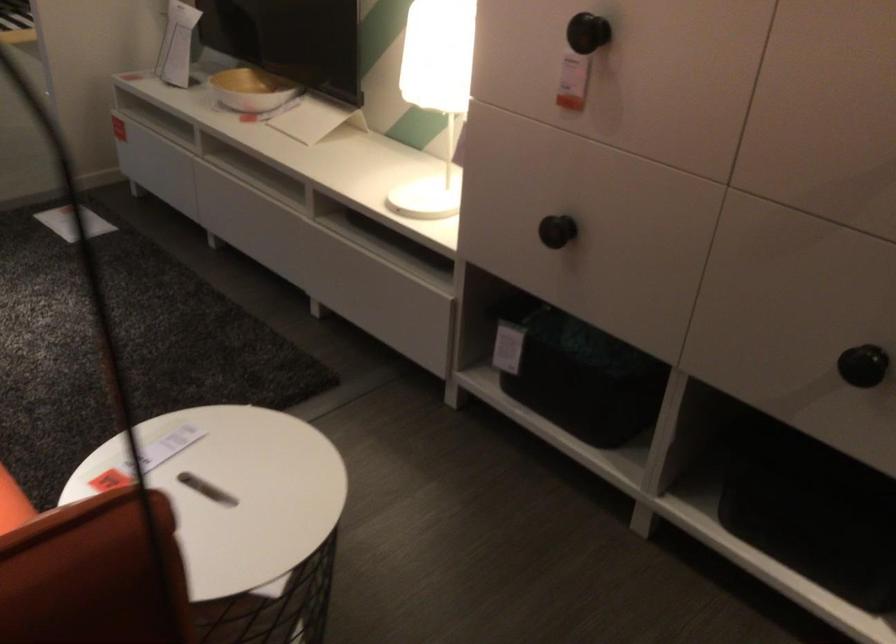
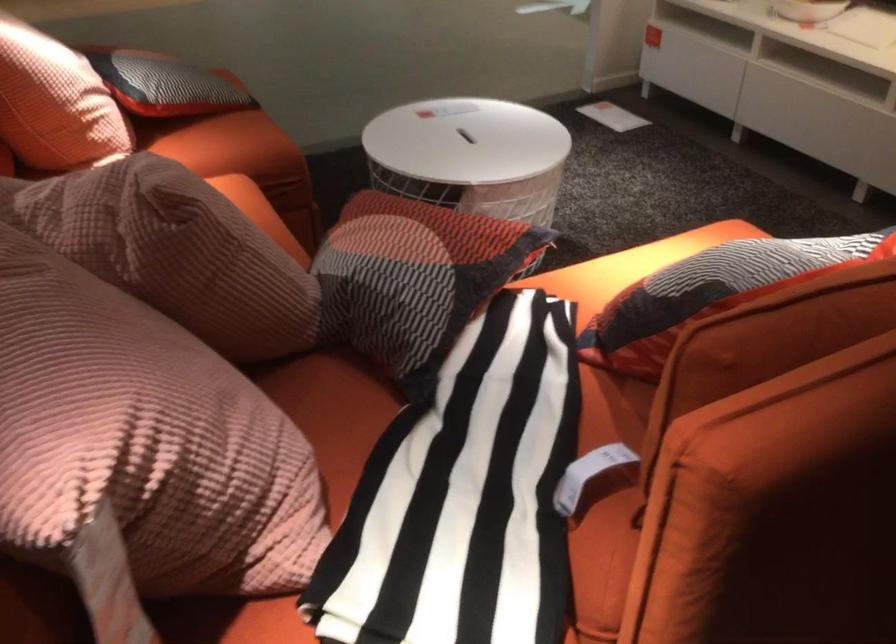
What movement of the cameraman would produce the second image?

The cameraman walked toward left, backward.